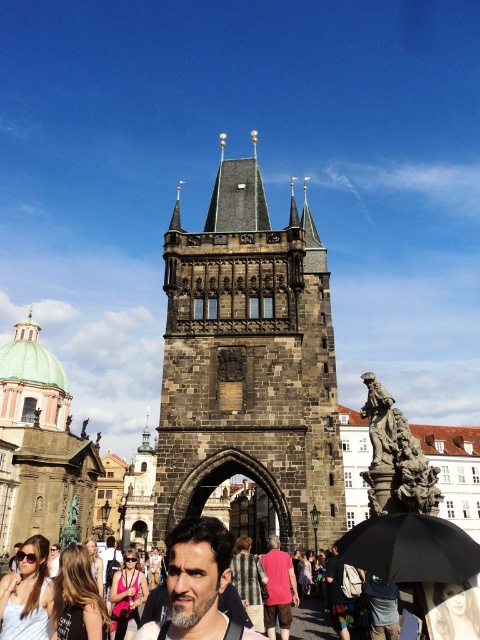
Question: Which of the following is the farthest from the observer?

Choices:
 (A) pos(268,563)
 (B) pos(193,518)
 (C) pos(334,604)

Answer: (A)

Question: Is white cotton shirt at lower left bigger than striped fabric shirt at center?

Choices:
 (A) no
 (B) yes

Answer: (A)

Question: Is dark brown hair at center further to camera compared to blonde hair at lower left?

Choices:
 (A) yes
 (B) no

Answer: (B)

Question: Which object appears farthest from the camera in this image?

Choices:
 (A) white cotton shirt at lower left
 (B) black matte umbrella at lower right

Answer: (A)

Question: Is white cotton shirt at lower left further to the viewer compared to striped fabric shirt at center?

Choices:
 (A) no
 (B) yes

Answer: (A)

Question: Which point is closer to the camera taking this photo?

Choices:
 (A) (118, 572)
 (B) (84, 554)
 (C) (256, 593)
 (D) (339, 584)

Answer: (B)